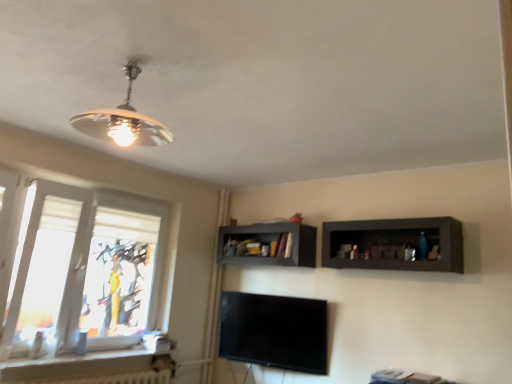
Identify the location of white glossy window sill at lower left. The width and height of the screenshot is (512, 384). (89, 362).

What do you see at coordinates (89, 362) in the screenshot? I see `white glossy window sill at lower left` at bounding box center [89, 362].

Locate an element on the screen. The width and height of the screenshot is (512, 384). matte gray shelf at center, the 2th shelf when ordered from right to left is located at coordinates (269, 243).

What is the approximate height of white textured window at left?

4.71 feet.

In order to face white textured window at left, should I rotate leftwards or rightwards?

To face it directly, rotate left by 19.686 degrees.

You are a GUI agent. You are given a task and a screenshot of the screen. Output one action in this format:
    pyautogui.click(x=<x>, y=<y>)
    Task: Click on the white glossy window sill at lower left
    This screenshot has height=384, width=512.
    Given the screenshot: What is the action you would take?
    pyautogui.click(x=89, y=362)

Is matte gray shelf at center, marked as the first shelf in a left-to-right arrangement, at the right side of white textured radiator at lower left?

Yes, matte gray shelf at center, marked as the first shelf in a left-to-right arrangement, is to the right of white textured radiator at lower left.

Could you tell me if matte gray shelf at center, the 2th shelf when ordered from right to left, is facing white textured radiator at lower left?

No, matte gray shelf at center, the 2th shelf when ordered from right to left, is not oriented towards white textured radiator at lower left.

Could you measure the distance between matte gray shelf at center, marked as the first shelf in a left-to-right arrangement, and white textured radiator at lower left?

matte gray shelf at center, marked as the first shelf in a left-to-right arrangement, and white textured radiator at lower left are 1.55 meters apart.

Could you tell me if dark wood shelf at right, acting as the first shelf starting from the right, is facing white textured radiator at lower left?

No, dark wood shelf at right, acting as the first shelf starting from the right, is not turned towards white textured radiator at lower left.

Can you confirm if dark wood shelf at right, the 2th shelf viewed from the back, is positioned to the left of white textured radiator at lower left?

Incorrect, dark wood shelf at right, the 2th shelf viewed from the back, is not on the left side of white textured radiator at lower left.

Which is closer, (412, 234) or (84, 379)?

Point (412, 234) appears to be closer to the viewer than point (84, 379).

From the picture: From the image's perspective, which one is positioned lower, dark wood shelf at right, the second shelf in the left-to-right sequence, or white textured radiator at lower left?

From the image's view, white textured radiator at lower left is below.

From a real-world perspective, between white textured radiator at lower left and white textured window at left, who is vertically lower?

white textured radiator at lower left is physically lower.

Could you tell me if white textured radiator at lower left is facing white textured window at left?

No, white textured radiator at lower left is not aimed at white textured window at left.

From the image's perspective, does white textured radiator at lower left appear higher than white textured window at left?

No, from the image's perspective, white textured radiator at lower left is not on top of white textured window at left.

Can you confirm if dark wood shelf at right, acting as the first shelf starting from the right, is bigger than white glossy window sill at lower left?

Yes, dark wood shelf at right, acting as the first shelf starting from the right, is bigger than white glossy window sill at lower left.

Considering the relative positions of dark wood shelf at right, positioned as the 1th shelf in front-to-back order, and white glossy window sill at lower left in the image provided, is dark wood shelf at right, positioned as the 1th shelf in front-to-back order, to the left of white glossy window sill at lower left from the viewer's perspective?

Incorrect, dark wood shelf at right, positioned as the 1th shelf in front-to-back order, is not on the left side of white glossy window sill at lower left.

How different are the orientations of dark wood shelf at right, the second shelf in the left-to-right sequence, and white glossy window sill at lower left in degrees?

dark wood shelf at right, the second shelf in the left-to-right sequence, and white glossy window sill at lower left are facing 90 degrees away from each other.

Can you see dark wood shelf at right, positioned as the 1th shelf in front-to-back order, touching white glossy window sill at lower left?

No.

Who is bigger, white textured radiator at lower left or dark wood shelf at right, acting as the first shelf starting from the right?

dark wood shelf at right, acting as the first shelf starting from the right.

From the image's perspective, does white textured radiator at lower left appear lower than dark wood shelf at right, the 2th shelf viewed from the back?

Yes, from the image's perspective, white textured radiator at lower left is below dark wood shelf at right, the 2th shelf viewed from the back.

Can you tell me how much white textured radiator at lower left and dark wood shelf at right, positioned as the 1th shelf in front-to-back order, differ in facing direction?

white textured radiator at lower left and dark wood shelf at right, positioned as the 1th shelf in front-to-back order, are facing 90 degrees away from each other.

Is dark wood shelf at right, the 2th shelf viewed from the back, located within white textured radiator at lower left?

No, dark wood shelf at right, the 2th shelf viewed from the back, is not inside white textured radiator at lower left.

Where is `the 1st shelf above the white textured window at left (from the image's perspective)`? Image resolution: width=512 pixels, height=384 pixels. the 1st shelf above the white textured window at left (from the image's perspective) is located at coordinates (269, 243).

Is white textured window at left with matte gray shelf at center, which is the first shelf from back to front?

No, white textured window at left is not making contact with matte gray shelf at center, which is the first shelf from back to front.

Is white textured window at left taller than matte gray shelf at center, marked as the first shelf in a left-to-right arrangement?

Indeed, white textured window at left has a greater height compared to matte gray shelf at center, marked as the first shelf in a left-to-right arrangement.

From a real-world perspective, is white textured window at left physically located above or below matte gray shelf at center, marked as the first shelf in a left-to-right arrangement?

From a real-world perspective, white textured window at left is physically below matte gray shelf at center, marked as the first shelf in a left-to-right arrangement.

Is white glossy window sill at lower left facing towards dark wood shelf at right, the second shelf in the left-to-right sequence?

No, white glossy window sill at lower left is not turned towards dark wood shelf at right, the second shelf in the left-to-right sequence.

Are white glossy window sill at lower left and dark wood shelf at right, acting as the first shelf starting from the right, beside each other?

white glossy window sill at lower left and dark wood shelf at right, acting as the first shelf starting from the right, are clearly separated.

Which of these two, white glossy window sill at lower left or dark wood shelf at right, acting as the first shelf starting from the right, stands shorter?

With less height is white glossy window sill at lower left.

Image resolution: width=512 pixels, height=384 pixels. What are the coordinates of `window sill that appears in front of the dark wood shelf at right, the 2th shelf viewed from the back` in the screenshot? It's located at (89, 362).

From the white textured radiator at lower left, count 1st shelf to the right and point to it. Please provide its 2D coordinates.

[(269, 243)]

At what (x,y) coordinates should I click in order to perform the action: click on the 2nd shelf above the white textured radiator at lower left (from the image's perspective). Please return your answer as a coordinate pair (x, y). This screenshot has width=512, height=384. Looking at the image, I should click on (395, 243).

Considering their positions, is white textured window at left positioned closer to white textured radiator at lower left than matte gray shelf at center, marked as the first shelf in a left-to-right arrangement?

Among the two, white textured window at left is located nearer to white textured radiator at lower left.

Based on their spatial positions, is matte gray shelf at center, which is the first shelf from back to front, or white textured window at left closer to white glossy window sill at lower left?

The object closer to white glossy window sill at lower left is white textured window at left.

From the image, which object appears to be farther from white glossy window sill at lower left, white textured radiator at lower left or matte gray shelf at center, marked as the first shelf in a left-to-right arrangement?

A: matte gray shelf at center, marked as the first shelf in a left-to-right arrangement, is further to white glossy window sill at lower left.

Which object lies nearer to the anchor point white textured window at left, white textured radiator at lower left or dark wood shelf at right, positioned as the 1th shelf in front-to-back order?

The object closer to white textured window at left is white textured radiator at lower left.

Which object lies nearer to the anchor point dark wood shelf at right, positioned as the 1th shelf in front-to-back order, white textured radiator at lower left or matte gray shelf at center, which is the 2th shelf in front-to-back order?

matte gray shelf at center, which is the 2th shelf in front-to-back order.

Consider the image. Looking at the image, which one is located further to dark wood shelf at right, positioned as the 1th shelf in front-to-back order, matte gray shelf at center, which is the first shelf from back to front, or white textured window at left?

white textured window at left lies further to dark wood shelf at right, positioned as the 1th shelf in front-to-back order, than the other object.

Estimate the real-world distances between objects in this image. Which object is closer to matte gray shelf at center, marked as the first shelf in a left-to-right arrangement, white textured radiator at lower left or white textured window at left?

white textured window at left.

Based on their spatial positions, is white textured window at left or white glossy window sill at lower left further from white textured radiator at lower left?

white textured window at left is further to white textured radiator at lower left.

Where is `window between white glossy window sill at lower left and matte gray shelf at center, which is the 2th shelf in front-to-back order`? The image size is (512, 384). window between white glossy window sill at lower left and matte gray shelf at center, which is the 2th shelf in front-to-back order is located at coordinates (86, 270).

Find the location of a particular element. The image size is (512, 384). shelf between white glossy window sill at lower left and dark wood shelf at right, positioned as the 1th shelf in front-to-back order, from left to right is located at coordinates (269, 243).

You are a GUI agent. You are given a task and a screenshot of the screen. Output one action in this format:
    pyautogui.click(x=<x>, y=<y>)
    Task: Click on the radiator situated between white glossy window sill at lower left and dark wood shelf at right, the 2th shelf viewed from the back, from left to right
    This screenshot has height=384, width=512.
    Given the screenshot: What is the action you would take?
    pyautogui.click(x=113, y=378)

Where is `window sill that lies between white textured window at left and white textured radiator at lower left from top to bottom`? The image size is (512, 384). window sill that lies between white textured window at left and white textured radiator at lower left from top to bottom is located at coordinates (89, 362).